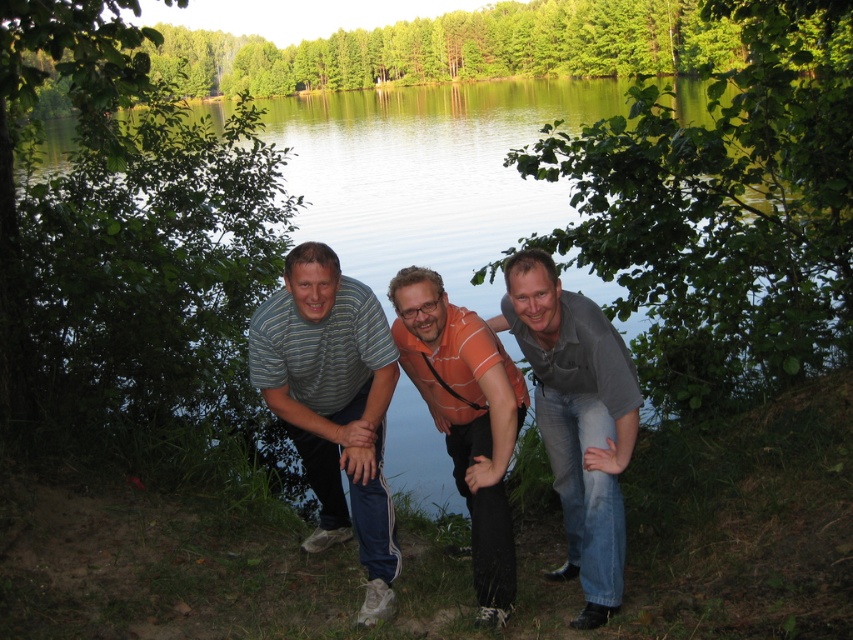
You are organizing a group photo shoot and need to ensure all participants can be clearly seen in the frame. Given that the striped cotton shirt at center and the gray matte shirt at center are both in the center, which one might be more visible due to its size?

The striped cotton shirt at center is bigger than the gray matte shirt at center, so it might be more visible in the frame due to its larger size.

You are planning to take a photo of the green water at center and the striped cotton shirt at center for a fashion magazine. Which object should be the main focus if you want to highlight the larger one?

The green water at center should be the main focus because it has a larger size compared to the striped cotton shirt at center.

You are standing at the camera position and want to hand a small gift to the person wearing the striped cotton shirt at center. Can you reach them without moving from your current position? The average human arm length is 0.7 meters.

The striped cotton shirt at center is 4.15 meters away from the camera. Since the average human arm length is only 0.7 meters, you cannot reach them without moving from your current position.